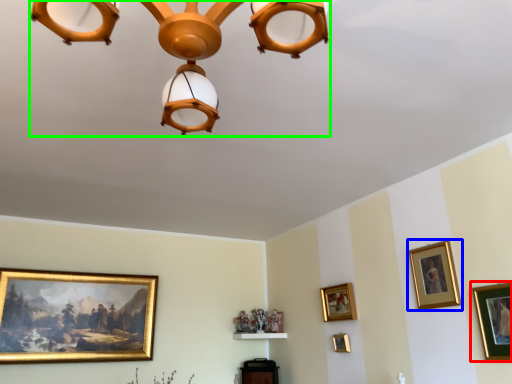
Question: Which is farther away from picture frame (highlighted by a red box)? picture frame (highlighted by a blue box) or lamp (highlighted by a green box)?

Choices:
 (A) picture frame
 (B) lamp

Answer: (B)